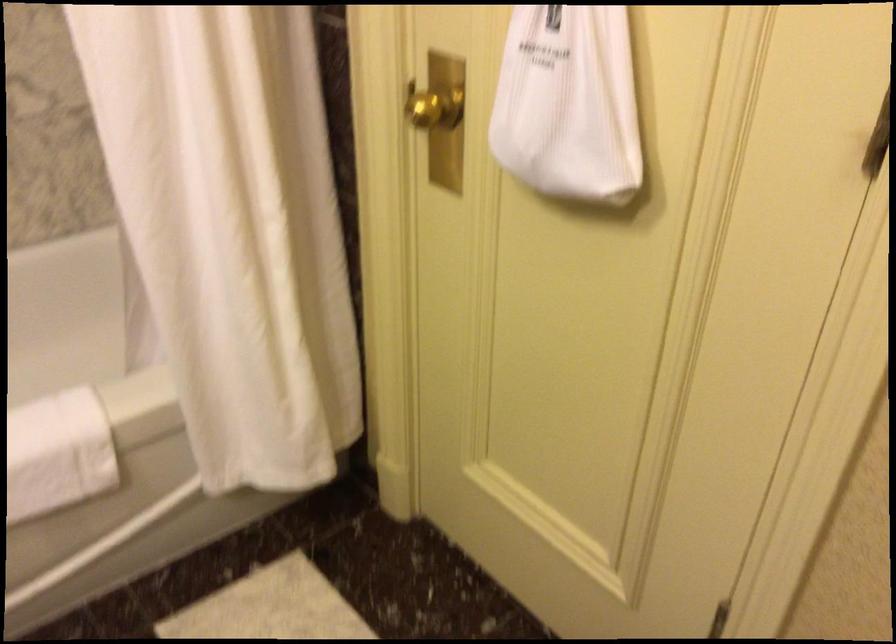
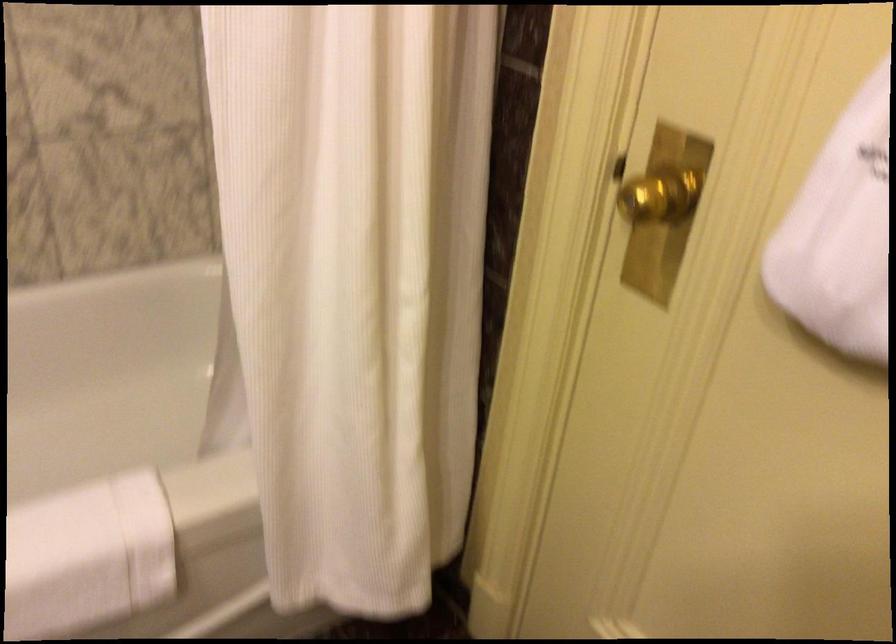
In a continuous first-person perspective shot, in which direction is the camera moving?

The cameraman walked toward left, forward.